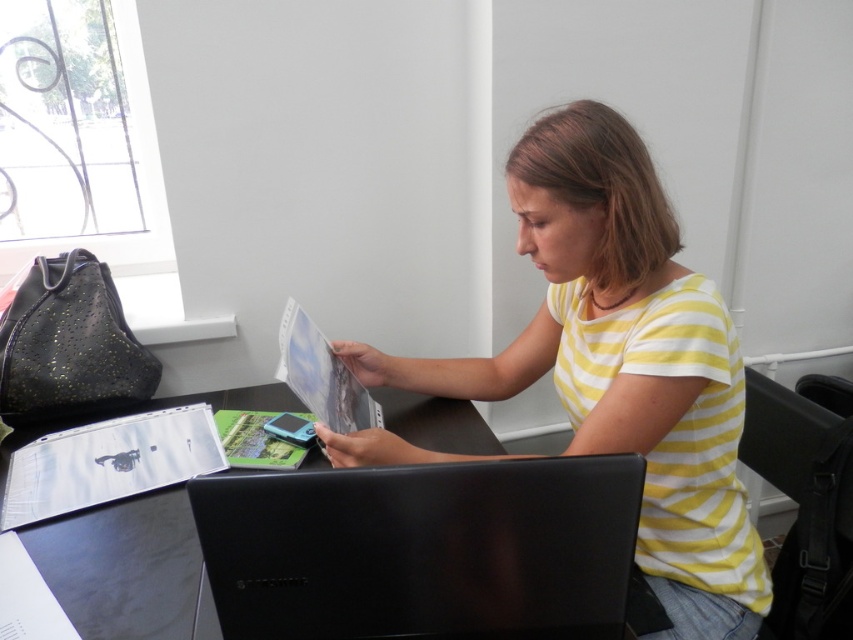
Question: Is yellow striped shirt at center smaller than black plastic laptop at center?

Choices:
 (A) yes
 (B) no

Answer: (B)

Question: Considering the relative positions of yellow striped shirt at center and black plastic laptop at center in the image provided, where is yellow striped shirt at center located with respect to black plastic laptop at center?

Choices:
 (A) right
 (B) left

Answer: (A)

Question: Estimate the real-world distances between objects in this image. Which object is farther from the black plastic laptop at center?

Choices:
 (A) yellow striped shirt at center
 (B) black plastic table at center

Answer: (A)

Question: Which object is closer to the camera taking this photo?

Choices:
 (A) yellow striped shirt at center
 (B) black plastic laptop at center
 (C) black plastic table at center

Answer: (C)

Question: Which of the following is the farthest from the observer?

Choices:
 (A) yellow striped shirt at center
 (B) black plastic laptop at center
 (C) black plastic table at center

Answer: (B)

Question: Is black plastic table at center bigger than yellow striped shirt at center?

Choices:
 (A) yes
 (B) no

Answer: (B)